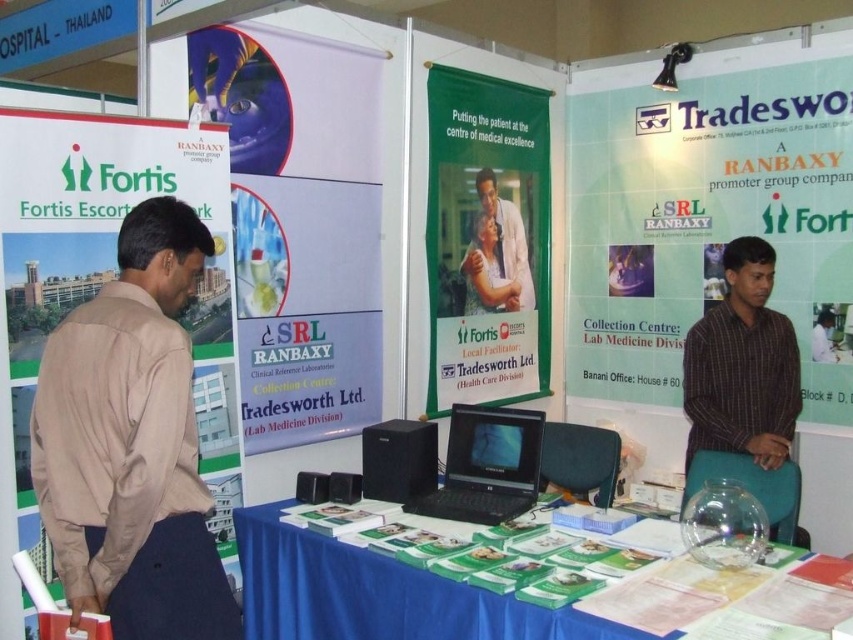
Question: Which of the following is the closest to the observer?

Choices:
 (A) black plastic laptop at center
 (B) white lab coat at center
 (C) blue fabric table at center

Answer: (C)

Question: Which object is the farthest from the green matte banner at center?

Choices:
 (A) green matte poster at right
 (B) white lab coat at center
 (C) blue fabric table at center
 (D) brown cotton shirt at left

Answer: (D)

Question: Is brown cotton shirt at left bigger than white lab coat at center?

Choices:
 (A) no
 (B) yes

Answer: (B)

Question: Which of the following is the farthest from the observer?

Choices:
 (A) (622, 227)
 (B) (500, 604)
 (C) (489, 209)

Answer: (A)

Question: Where is brown striped shirt at right located in relation to black plastic laptop at center in the image?

Choices:
 (A) above
 (B) below

Answer: (A)

Question: From the image, what is the correct spatial relationship of brown cotton shirt at left in relation to brown striped shirt at right?

Choices:
 (A) above
 (B) below

Answer: (B)